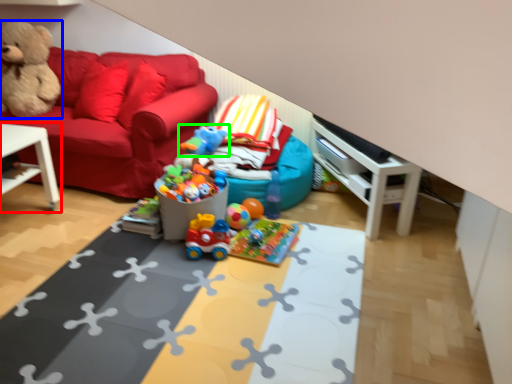
Question: Which object is the farthest from table (highlighted by a red box)? Choose among these: teddy bear (highlighted by a blue box) or toy (highlighted by a green box).

Choices:
 (A) teddy bear
 (B) toy

Answer: (B)